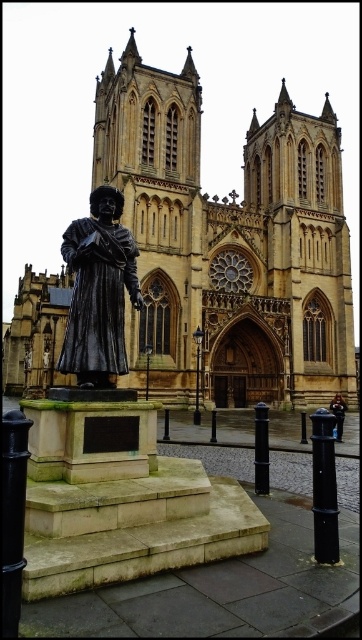
You are standing at the entrance of the cathedral and want to locate the beige stone church at center. According to the coordinates provided, where should you look?

The beige stone church at center is located at coordinates point (x=229, y=244).

You are standing in front of the beige stone church at center and want to take a photo of the polished bronze statue at center. Since the statue is behind the church, will you need to move around the church to get a clear view of the statue?

The polished bronze statue at center is behind the beige stone church at center, so you will need to move around the church to get a clear view of the statue.

You are a visitor standing at the entrance of the beige stone church at center and looking towards the polished bronze statue at center. Which object appears taller from your perspective?

The beige stone church at center appears taller than the polished bronze statue at center from your perspective because the church is much taller as described.